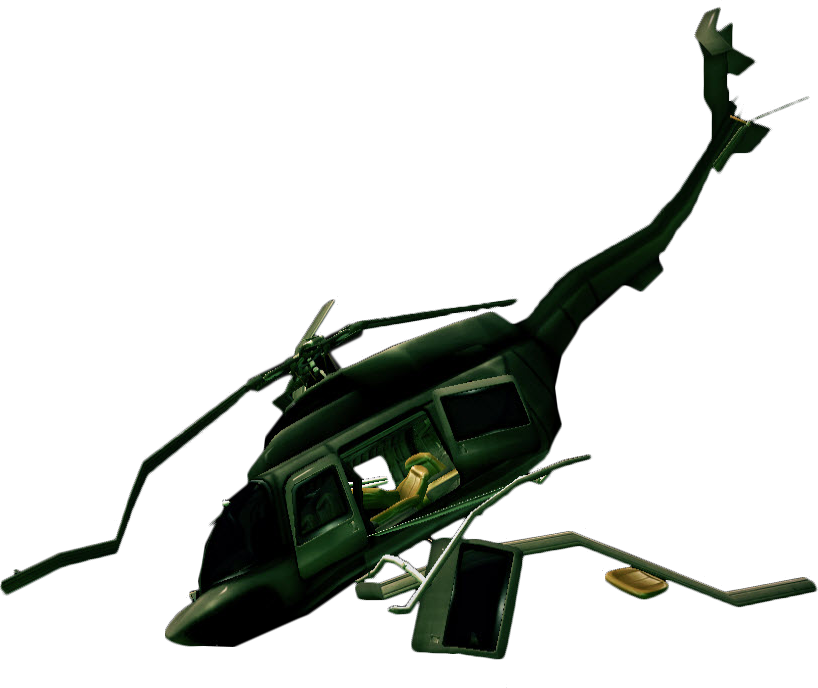
Identify the location of door. Image resolution: width=818 pixels, height=688 pixels. (501, 644).